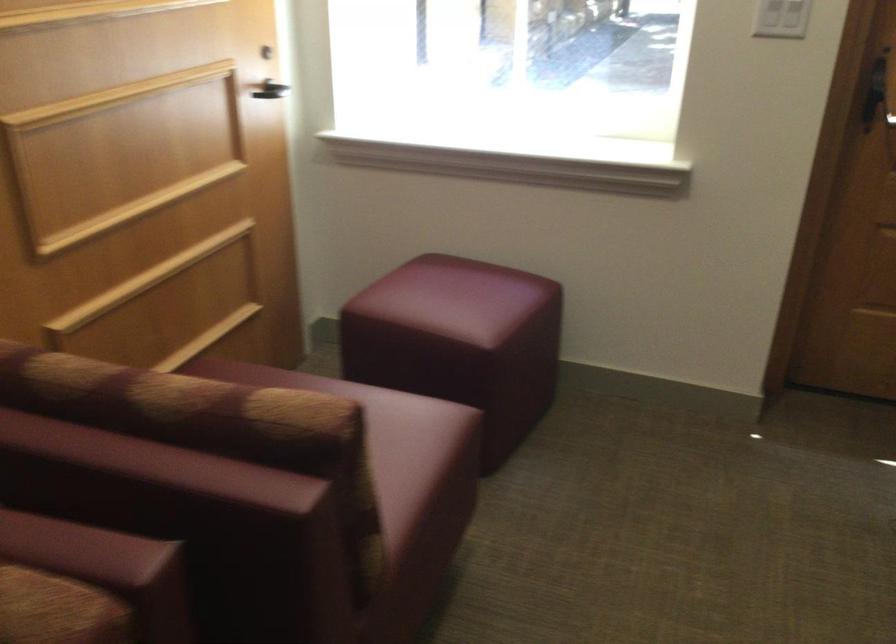
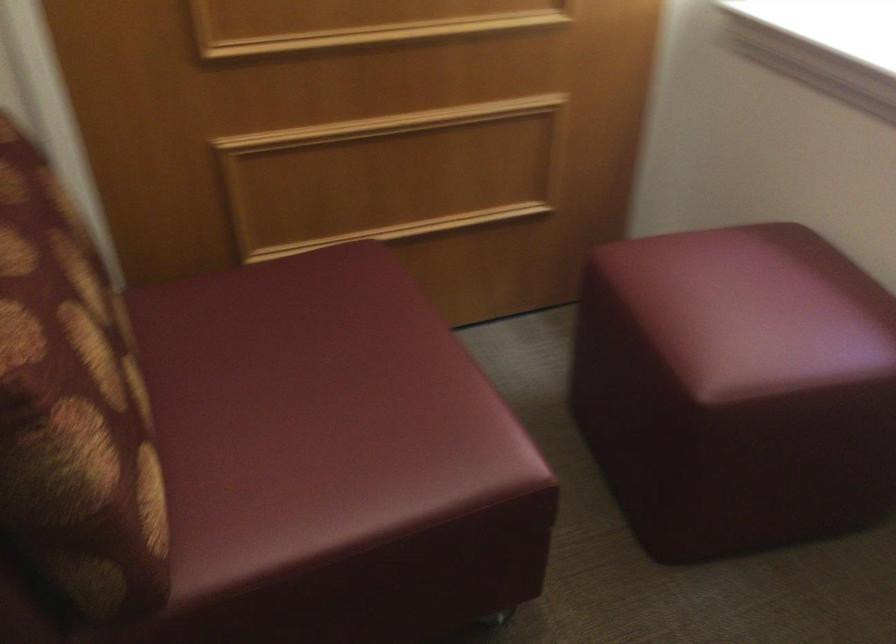
In the second image, find the point that corresponds to (314,438) in the first image.

(72, 406)